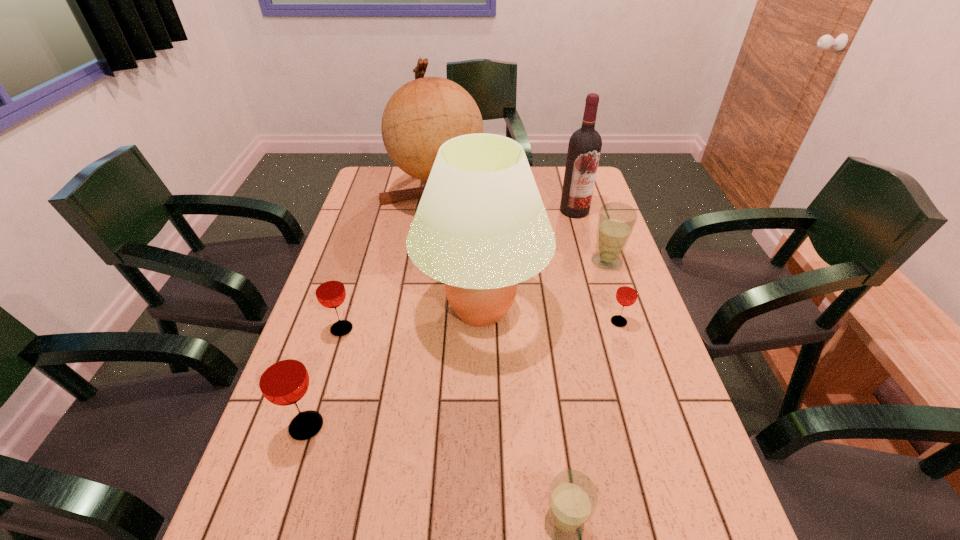
Image resolution: width=960 pixels, height=540 pixels. In order to click on globe in this screenshot , I will do `click(423, 114)`.

The width and height of the screenshot is (960, 540). In order to click on beige lampshade in this screenshot , I will do `click(481, 227)`.

You are a GUI agent. You are given a task and a screenshot of the screen. Output one action in this format:
    pyautogui.click(x=<x>, y=<y>)
    Task: Click on the wine bottle
    This screenshot has height=540, width=960.
    Given the screenshot: What is the action you would take?
    pyautogui.click(x=585, y=144)

Where is `the fourth tallest object`? Image resolution: width=960 pixels, height=540 pixels. the fourth tallest object is located at coordinates (282, 377).

Locate an element on the screen. Image resolution: width=960 pixels, height=540 pixels. the second nearest object is located at coordinates (282, 377).

The width and height of the screenshot is (960, 540). Identify the location of the second biggest red glass. (330, 292).

You are a GUI agent. You are given a task and a screenshot of the screen. Output one action in this format:
    pyautogui.click(x=<x>, y=<y>)
    Task: Click on the bigger blue glass
    
    Given the screenshot: What is the action you would take?
    pyautogui.click(x=616, y=221)

The height and width of the screenshot is (540, 960). Find the location of `the farther blue glass`. the farther blue glass is located at coordinates (616, 221).

Identify the location of the rightmost red glass. This screenshot has height=540, width=960. (627, 292).

Identify the location of vacant point located 0.190m on the surface of the globe. The width and height of the screenshot is (960, 540). (426, 262).